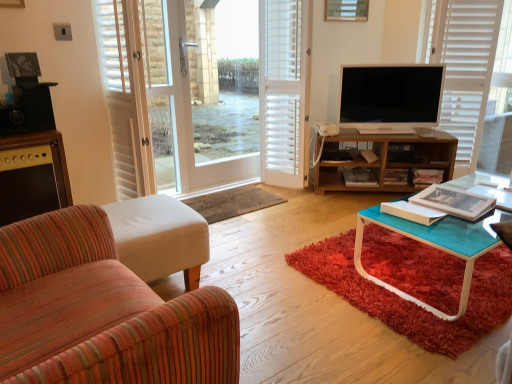
Question: Is white wooden blind at upper right completely or partially inside white wood screen door at center?

Choices:
 (A) yes
 (B) no

Answer: (B)

Question: Can you confirm if white wood screen door at center is taller than white wooden blind at upper right?

Choices:
 (A) no
 (B) yes

Answer: (A)

Question: Is the position of white wood screen door at center more distant than that of white wooden blind at upper right?

Choices:
 (A) no
 (B) yes

Answer: (A)

Question: Is white wood screen door at center facing towards white wooden blind at upper right?

Choices:
 (A) no
 (B) yes

Answer: (A)

Question: Can you confirm if white wood screen door at center is smaller than white wooden blind at upper right?

Choices:
 (A) yes
 (B) no

Answer: (A)

Question: From a real-world perspective, is flat screen tv at center physically located above or below matte black speaker at left?

Choices:
 (A) above
 (B) below

Answer: (A)

Question: In terms of width, does flat screen tv at center look wider or thinner when compared to matte black speaker at left?

Choices:
 (A) wide
 (B) thin

Answer: (B)

Question: From the image's perspective, is flat screen tv at center above or below matte black speaker at left?

Choices:
 (A) below
 (B) above

Answer: (B)

Question: Considering the positions of point (352, 71) and point (25, 205), is point (352, 71) closer or farther from the camera than point (25, 205)?

Choices:
 (A) closer
 (B) farther

Answer: (B)

Question: From the image's perspective, relative to rug at center, is wooden shelf at center above or below?

Choices:
 (A) below
 (B) above

Answer: (B)

Question: Is wooden shelf at center in front of or behind rug at center in the image?

Choices:
 (A) behind
 (B) front

Answer: (A)

Question: Is point [x=423, y=135] positioned closer to the camera than point [x=257, y=200]?

Choices:
 (A) closer
 (B) farther

Answer: (B)

Question: In the image, is wooden shelf at center on the left side or the right side of rug at center?

Choices:
 (A) right
 (B) left

Answer: (A)

Question: From a real-world perspective, is striped fabric armchair at left, which is counted as the first chair, starting from the back, physically located above or below matte black speaker at left?

Choices:
 (A) below
 (B) above

Answer: (A)

Question: From the image's perspective, is striped fabric armchair at left, which is counted as the first chair, starting from the back, positioned above or below matte black speaker at left?

Choices:
 (A) above
 (B) below

Answer: (B)